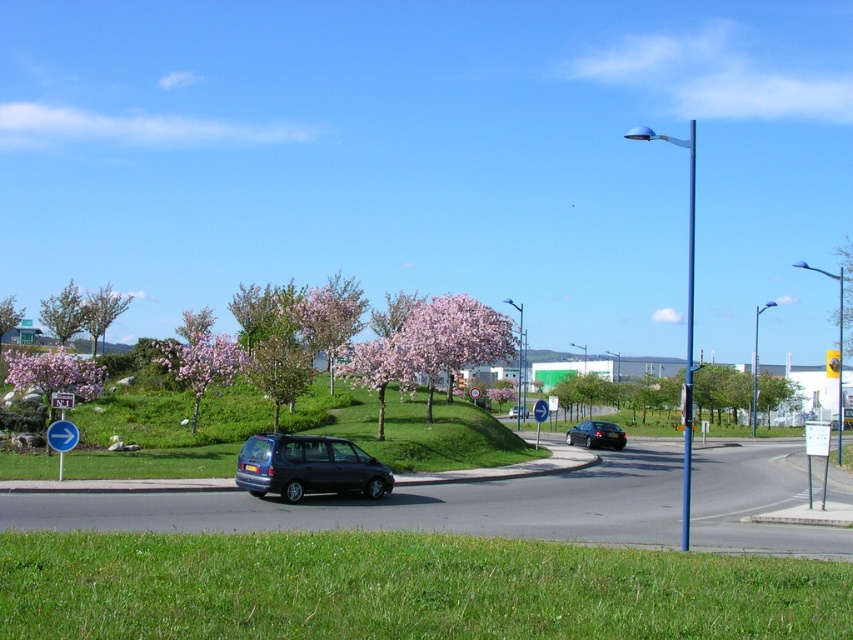
Question: Can you confirm if pink blossoming tree at left is positioned above maroon plastic sign at center?

Choices:
 (A) yes
 (B) no

Answer: (A)

Question: Which of the following is the farthest from the observer?

Choices:
 (A) pink blossoms at center
 (B) pink blossoming tree at center

Answer: (B)

Question: Which object is positioned closest to the pink blossoming tree at left?

Choices:
 (A) matte black van at center
 (B) shiny black sedan at center
 (C) maroon plastic sign at center

Answer: (C)

Question: Which point is closer to the camera taking this photo?

Choices:
 (A) (607, 435)
 (B) (67, 339)
 (C) (709, 410)
 (D) (15, 308)

Answer: (A)

Question: Is pink blossoms at center above pink blossoming tree at center?

Choices:
 (A) no
 (B) yes

Answer: (A)

Question: Can you confirm if pink blossoming tree at upper left is bigger than matte black van at center?

Choices:
 (A) no
 (B) yes

Answer: (B)